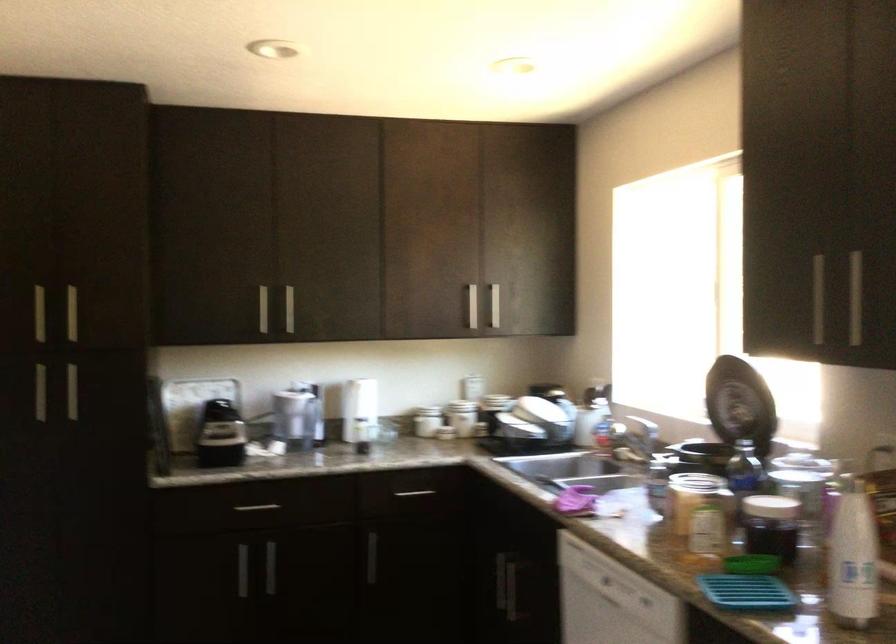
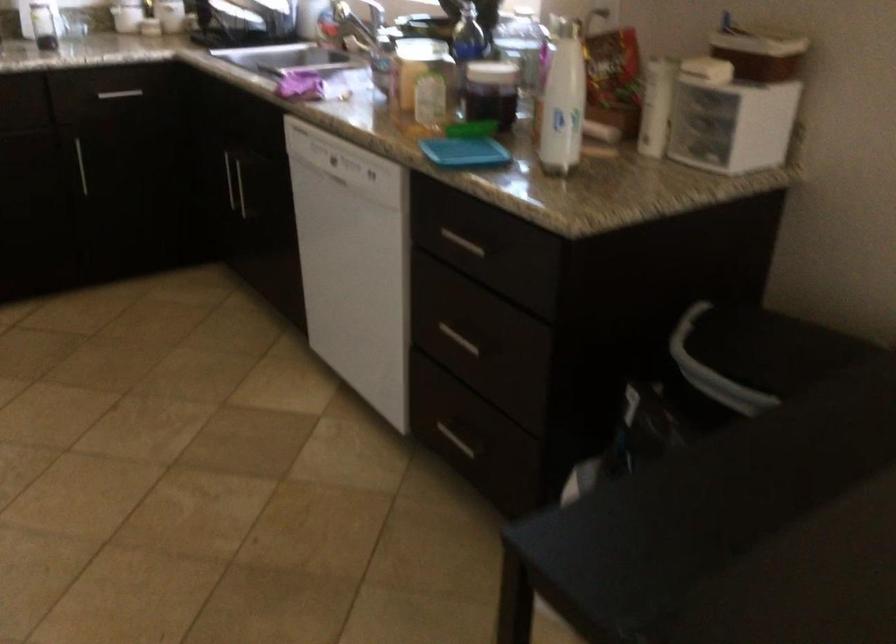
Locate, in the second image, the point that corresponds to [415,495] in the first image.

(119, 93)